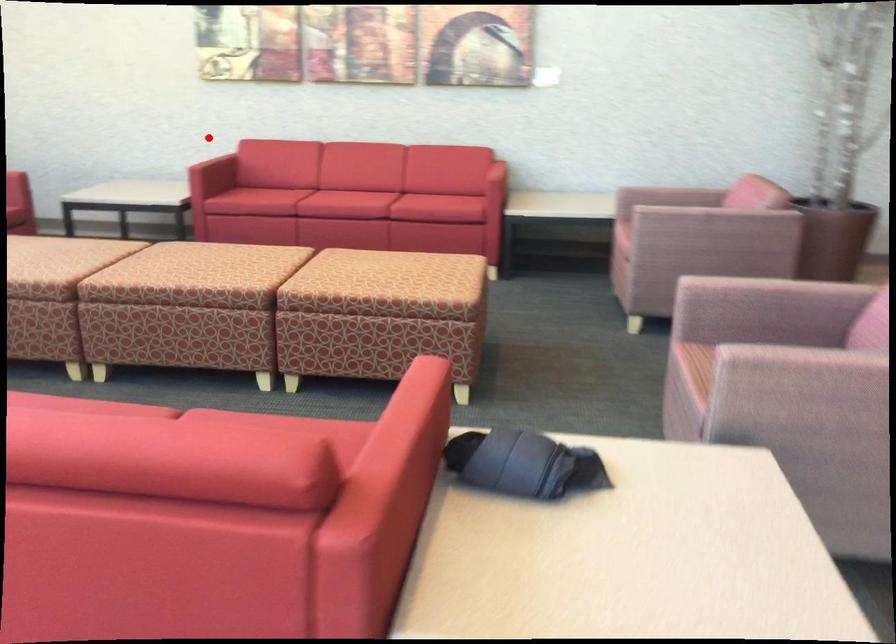
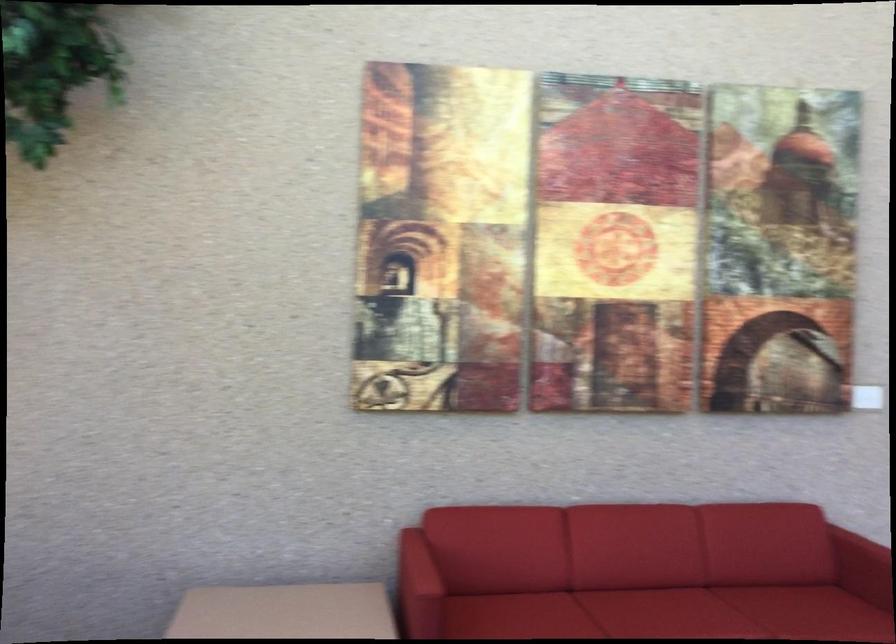
The point at the highlighted location is marked in the first image. Where is the corresponding point in the second image?

(418, 564)